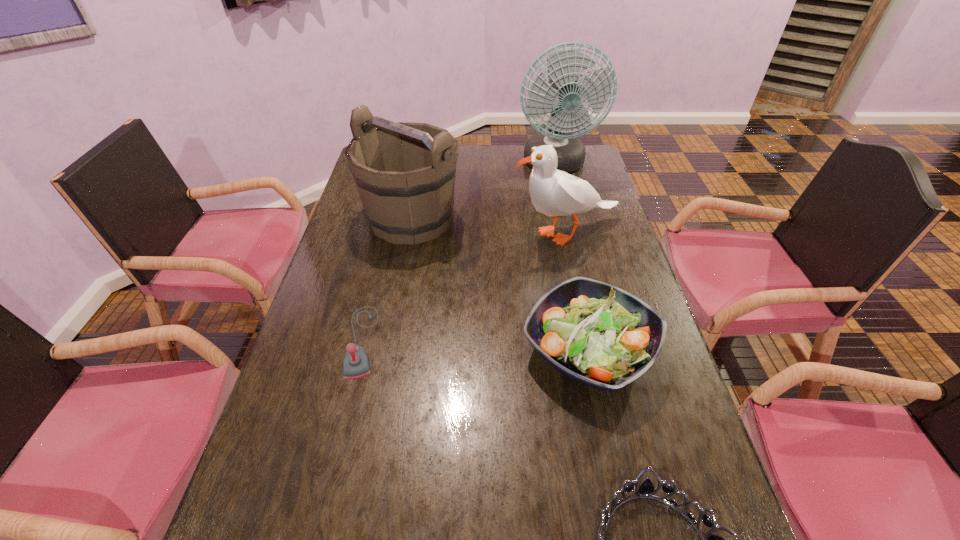
Identify the location of the tallest object. The height and width of the screenshot is (540, 960). point(561,98).

The width and height of the screenshot is (960, 540). In order to click on fan in this screenshot , I will do `click(561, 98)`.

Locate an element on the screen. Image resolution: width=960 pixels, height=540 pixels. bucket is located at coordinates (401, 208).

Find the location of a particular element. Image resolution: width=960 pixels, height=540 pixels. gull is located at coordinates (553, 192).

Identify the location of salad plate. This screenshot has width=960, height=540. (595, 333).

Identify the location of joystick. The width and height of the screenshot is (960, 540). (x=356, y=364).

Where is `free space located in front of the fan where the airflow is directed`? The image size is (960, 540). free space located in front of the fan where the airflow is directed is located at coordinates (577, 257).

This screenshot has width=960, height=540. Find the location of `vacant region located on the back of the bucket`. vacant region located on the back of the bucket is located at coordinates (425, 146).

Find the location of a particular element. The height and width of the screenshot is (540, 960). free space located 0.240m at the beak of the gull is located at coordinates (435, 234).

Identify the location of vacant position located 0.200m at the beak of the gull. (447, 234).